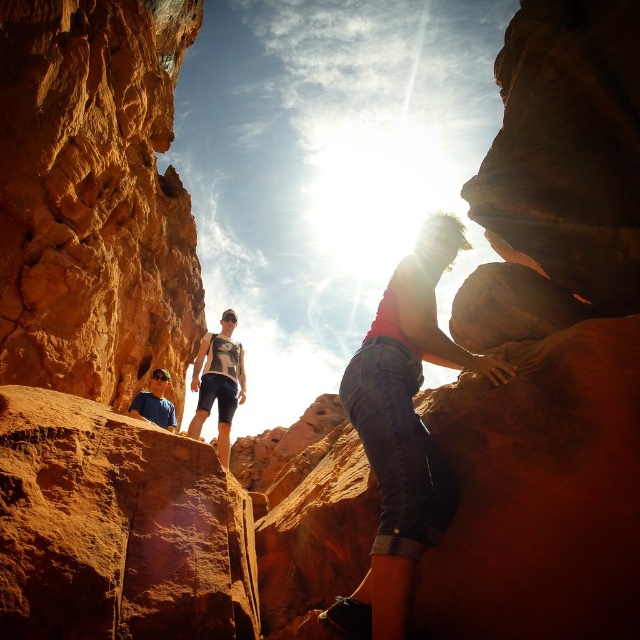
Question: Which point is closer to the camera taking this photo?

Choices:
 (A) (192, 336)
 (B) (198, 390)

Answer: (B)

Question: Among these points, which one is nearest to the camera?

Choices:
 (A) coord(211,376)
 (B) coord(348,404)

Answer: (B)

Question: Can you confirm if rustic sandstone rock at left is wider than matte blue shirt at lower left?

Choices:
 (A) no
 (B) yes

Answer: (B)

Question: Can you confirm if denim shorts at center is positioned to the left of printed cotton t-shirt at center?

Choices:
 (A) yes
 (B) no

Answer: (B)

Question: Is printed cotton t-shirt at center smaller than matte blue shirt at lower left?

Choices:
 (A) yes
 (B) no

Answer: (B)

Question: Which of the following is the farthest from the observer?

Choices:
 (A) (140, 195)
 (B) (438, 356)
 (C) (216, 364)

Answer: (A)